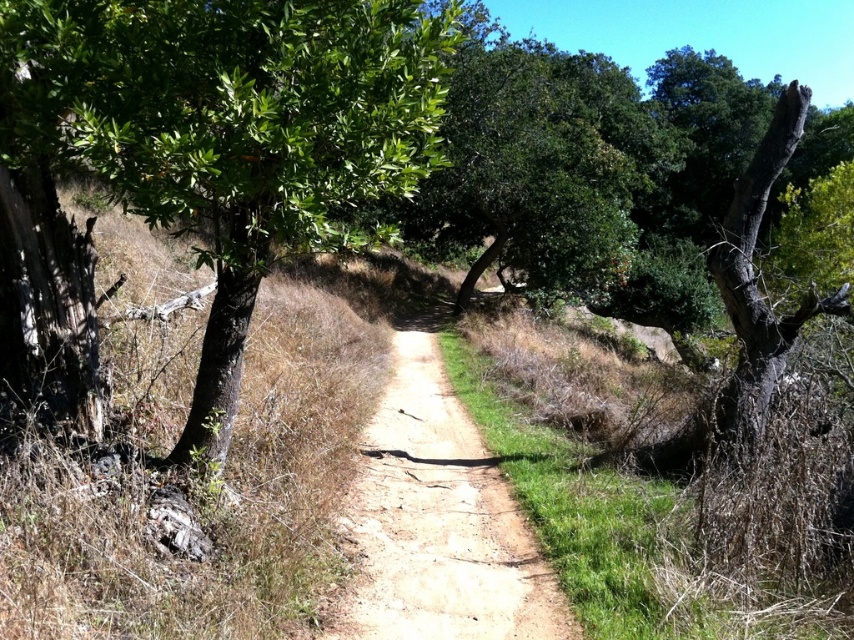
Question: Considering the relative positions of green leafy tree at left and dirt path at center in the image provided, where is green leafy tree at left located with respect to dirt path at center?

Choices:
 (A) above
 (B) below

Answer: (A)

Question: Which point is farther to the camera?

Choices:
 (A) green leafy tree at left
 (B) dirt path at center

Answer: (B)

Question: Which point is farther from the camera taking this photo?

Choices:
 (A) (377, 465)
 (B) (153, 204)

Answer: (A)

Question: Which point is closer to the camera taking this photo?

Choices:
 (A) (13, 148)
 (B) (574, 628)

Answer: (A)

Question: Is green leafy tree at left behind dirt path at center?

Choices:
 (A) no
 (B) yes

Answer: (A)

Question: Where is green leafy tree at left located in relation to dirt path at center in the image?

Choices:
 (A) right
 (B) left

Answer: (B)